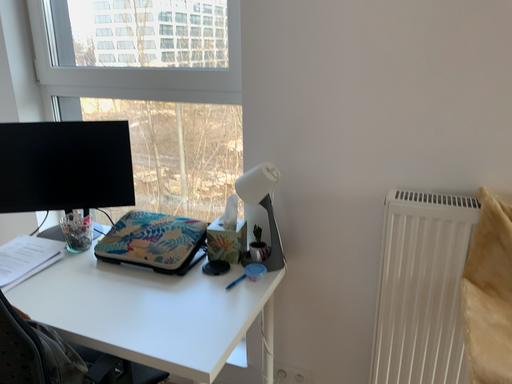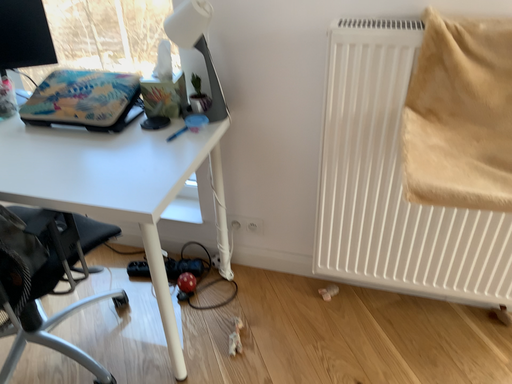
Question: Which way did the camera rotate in the video?

Choices:
 (A) rotated upward
 (B) rotated downward

Answer: (B)